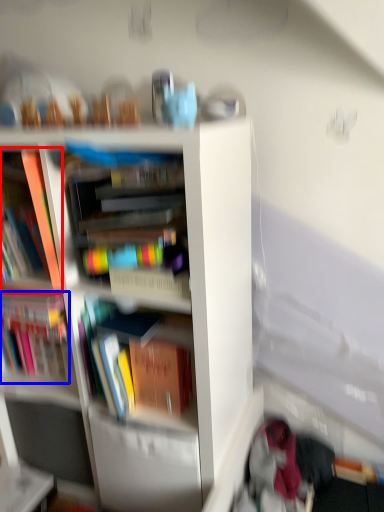
Question: Which object appears closest to the camera in this image, book (highlighted by a red box) or book (highlighted by a blue box)?

Choices:
 (A) book
 (B) book

Answer: (A)